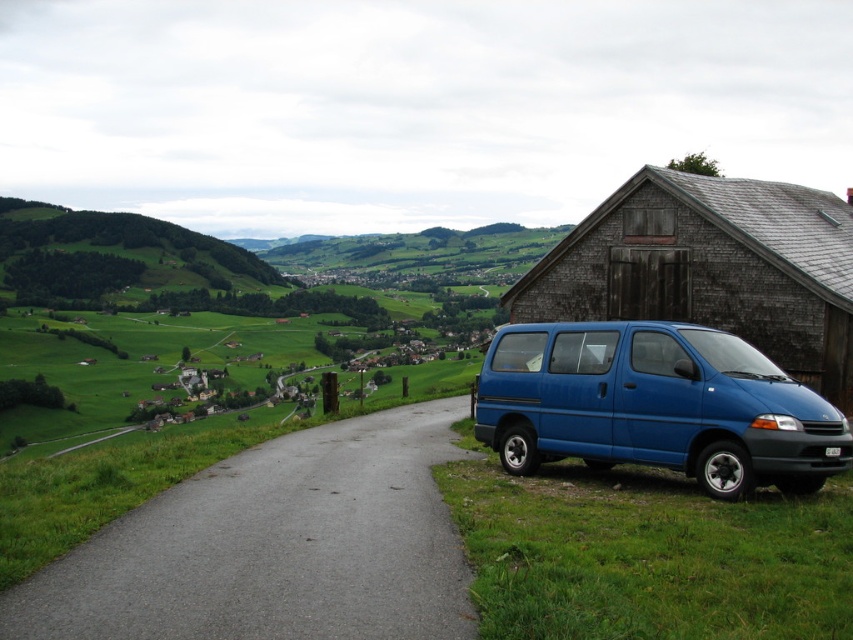
Which of these two, gray asphalt road at center or blue matte van at lower right, stands shorter?

gray asphalt road at center is shorter.

Between gray asphalt road at center and blue matte van at lower right, which one is positioned higher?

blue matte van at lower right is higher up.

Between point (236, 534) and point (508, 440), which one is positioned behind?

The point (508, 440) is more distant.

Where is `gray asphalt road at center`? The height and width of the screenshot is (640, 853). gray asphalt road at center is located at coordinates (276, 547).

Is point (751, 234) positioned before point (160, 230)?

Yes, it is in front of point (160, 230).

Is wooden barn at right to the right of green grassy hillside at upper left from the viewer's perspective?

Indeed, wooden barn at right is positioned on the right side of green grassy hillside at upper left.

The image size is (853, 640). I want to click on wooden barn at right, so click(711, 268).

You are a GUI agent. You are given a task and a screenshot of the screen. Output one action in this format:
    pyautogui.click(x=<x>, y=<y>)
    Task: Click on the wooden barn at right
    The width and height of the screenshot is (853, 640).
    Given the screenshot: What is the action you would take?
    pyautogui.click(x=711, y=268)

Who is taller, blue matte van at lower right or green grassy hillside at upper left?

Standing taller between the two is green grassy hillside at upper left.

Which is more to the right, blue matte van at lower right or green grassy hillside at upper left?

Positioned to the right is blue matte van at lower right.

Is point (692, 435) farther from camera compared to point (3, 282)?

No, it is in front of (3, 282).

I want to click on blue matte van at lower right, so click(x=654, y=404).